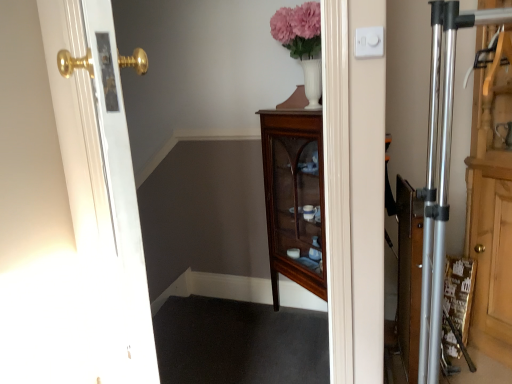
Find the location of a particular element. free region under mahogany glass-front cabinet at center (from a real-world perspective) is located at coordinates (293, 330).